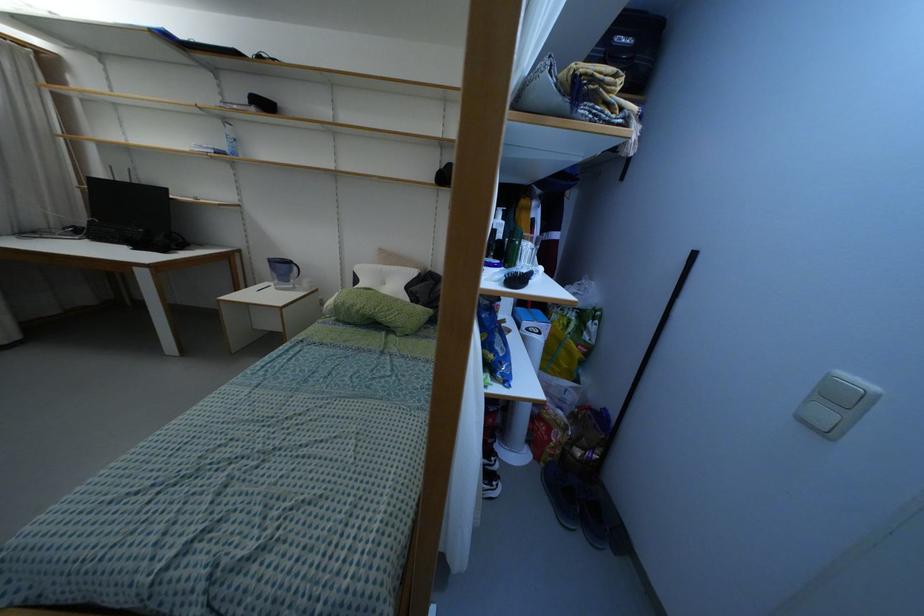
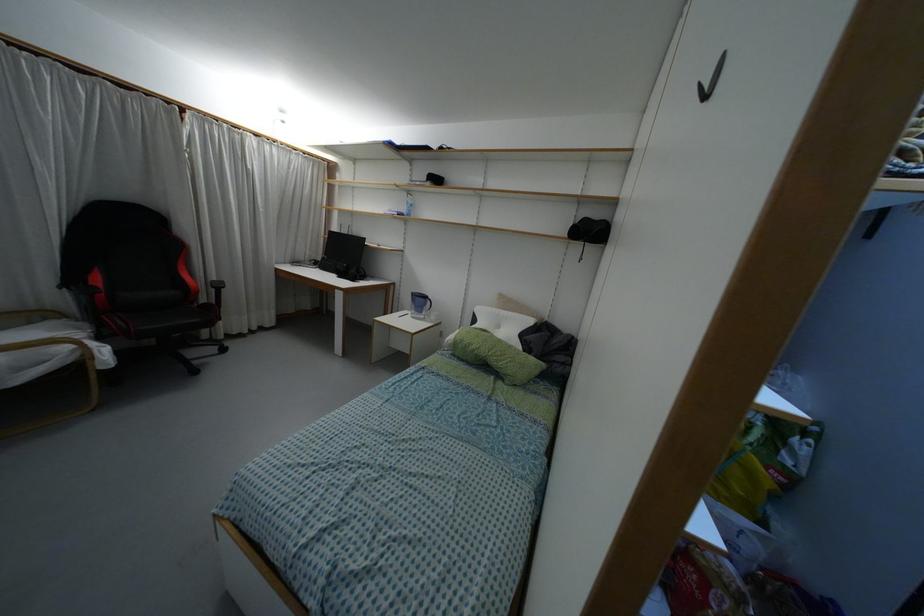
The point at (334, 301) is marked in the first image. Where is the corresponding point in the second image?

(455, 337)